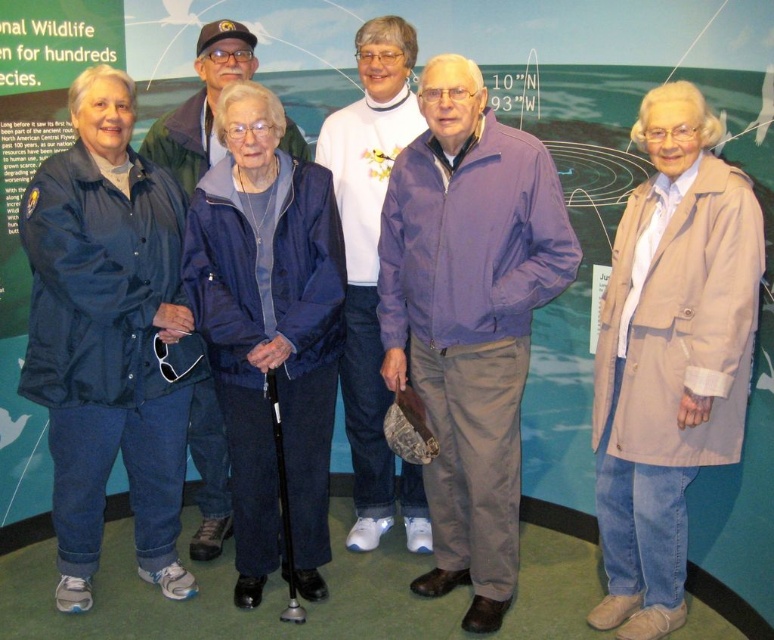
You are standing in the museum and want to take a photo of the purple fabric jacket at center. Where should you position yourself to capture it in the frame?

To capture the purple fabric jacket at center in the frame, position yourself directly in front of it since it is located at the center of the image at point coordinates (468, 317).

You are an event organizer arranging a photo shoot for the group. You need to place the matte blue jacket at left and the white matte sweater at center in a line for a group photo. Which should be placed first from the left side?

The matte blue jacket at left should be placed first from the left side because it is positioned on the left side of the white matte sweater at center.

You are an event organizer who needs to arrange a coat rack for guests. The guests include someone wearing a beige fabric coat at center and another wearing a brushed metal jacket at upper left. Which coat requires a larger hook size?

The beige fabric coat at center requires a larger hook because it has a larger size compared to the brushed metal jacket at upper left.